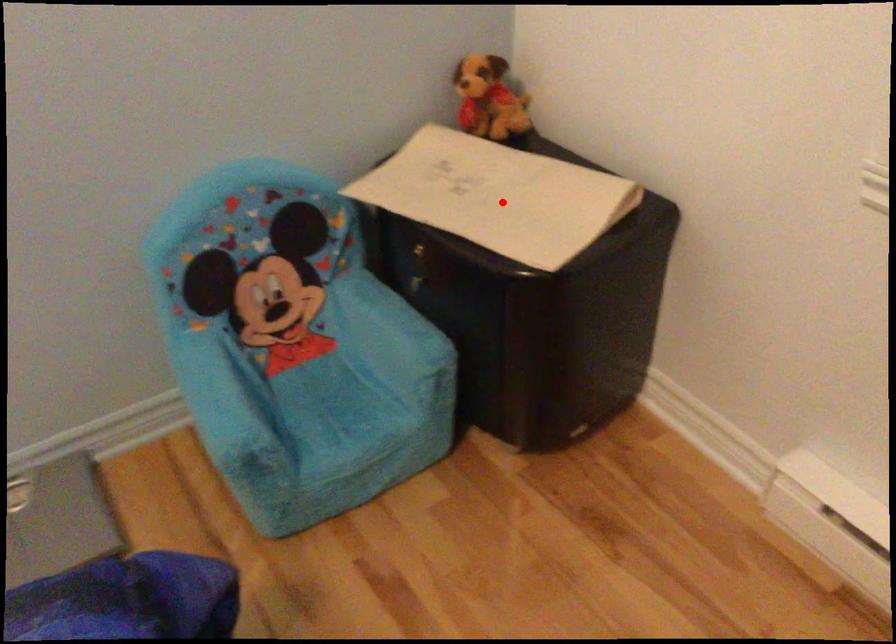
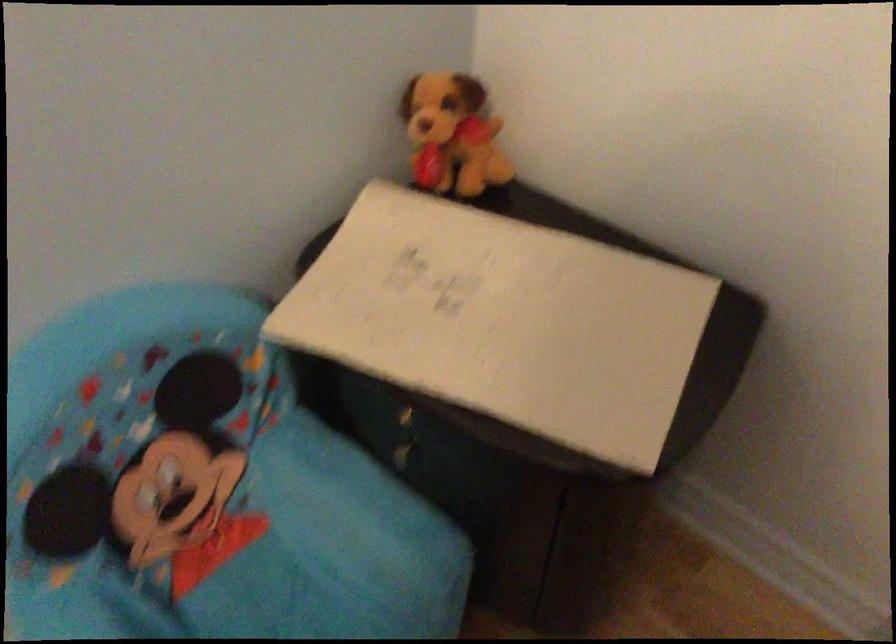
In the second image, find the point that corresponds to the highlighted location in the first image.

(521, 323)